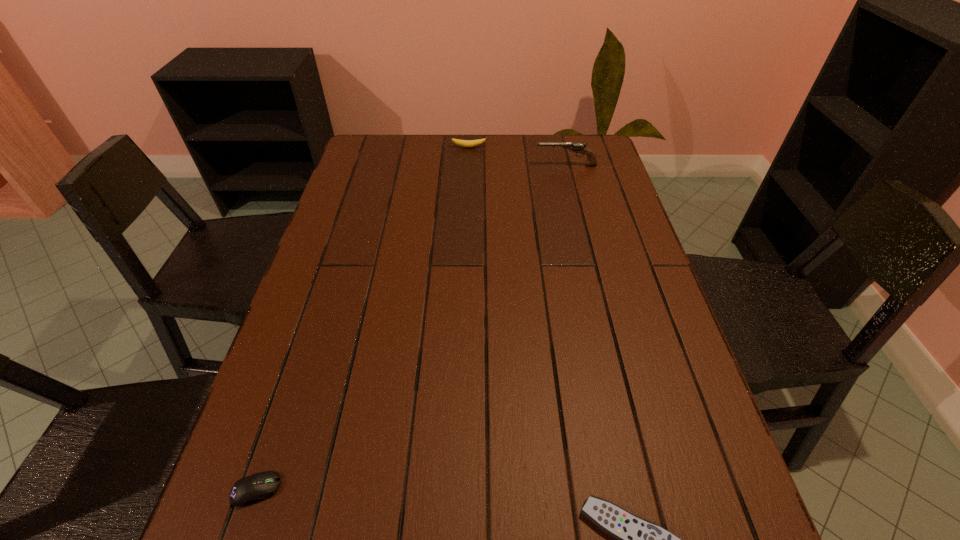
At what (x,y) coordinates should I click in order to perform the action: click on the tallest object. Please return your answer as a coordinate pair (x, y). The width and height of the screenshot is (960, 540). Looking at the image, I should click on (578, 147).

Where is `the third nearest object`? the third nearest object is located at coordinates (578, 147).

This screenshot has width=960, height=540. Find the location of `banana`. banana is located at coordinates (465, 143).

Where is `the second tallest object`? The width and height of the screenshot is (960, 540). the second tallest object is located at coordinates (465, 143).

Where is `the leftmost object`? This screenshot has height=540, width=960. the leftmost object is located at coordinates (260, 486).

Locate an element on the screen. the second shortest object is located at coordinates point(260,486).

This screenshot has width=960, height=540. What are the coordinates of `vacant space situated aiming along the barrel of the gun` in the screenshot? It's located at (514, 166).

The height and width of the screenshot is (540, 960). What are the coordinates of `vacant space located aiming along the barrel of the gun` in the screenshot? It's located at (443, 166).

Where is `blank space located aiming along the barrel of the gun`? blank space located aiming along the barrel of the gun is located at coordinates (443, 166).

The image size is (960, 540). In order to click on vacant area situated on the front of the third shortest object in this screenshot , I will do `click(468, 158)`.